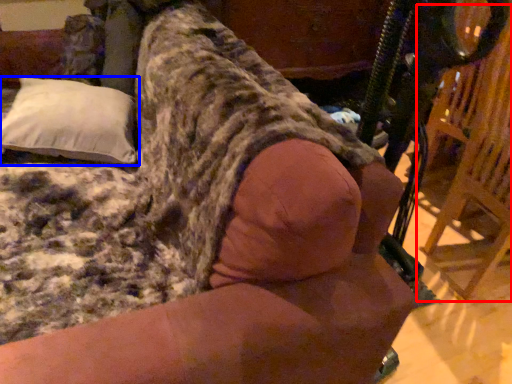
Question: Which point is further to the camera, swivel chair (highlighted by a red box) or pillow (highlighted by a blue box)?

Choices:
 (A) swivel chair
 (B) pillow

Answer: (B)